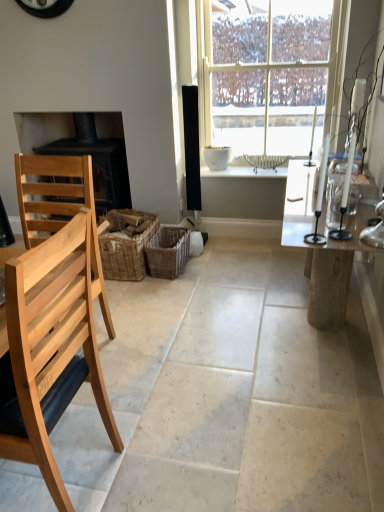
I want to click on free space between clear glass table at right and woven brown basket at center, the 1th crate positioned from the right, so click(x=235, y=287).